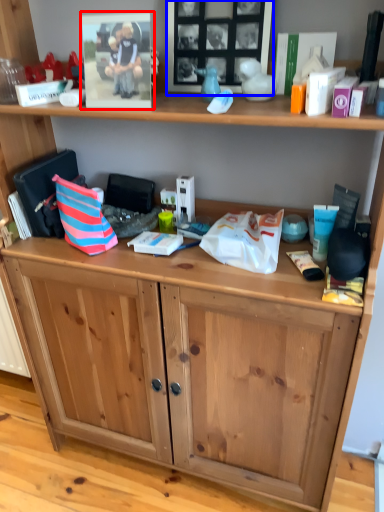
Question: Among these objects, which one is farthest to the camera, picture frame (highlighted by a red box) or picture frame (highlighted by a blue box)?

Choices:
 (A) picture frame
 (B) picture frame

Answer: (B)